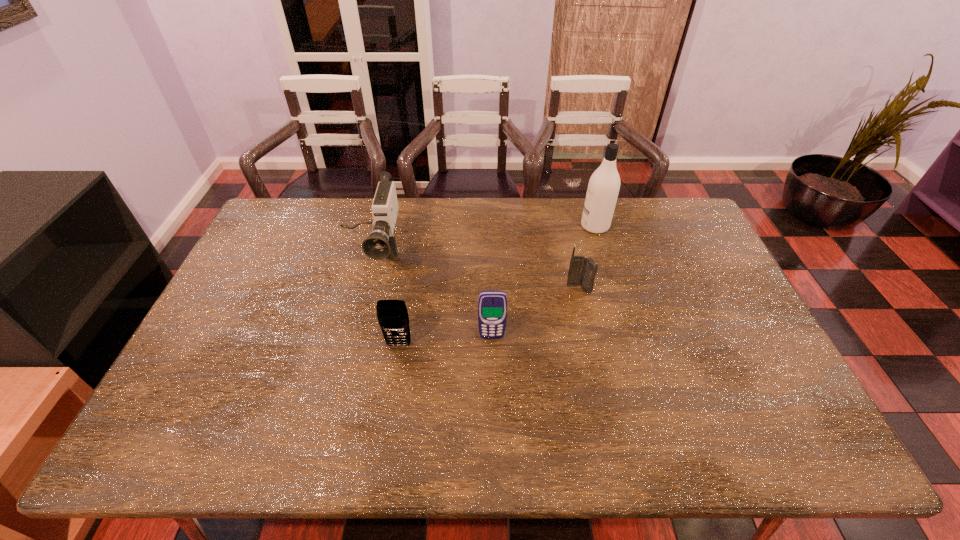
Where is `the rightmost object`? the rightmost object is located at coordinates (603, 188).

I want to click on shampoo, so (603, 188).

Identify the location of camcorder. The height and width of the screenshot is (540, 960). (381, 243).

The width and height of the screenshot is (960, 540). In order to click on the third object from left to right in this screenshot , I will do `click(492, 305)`.

Identify the location of the second farthest cellular telephone. The height and width of the screenshot is (540, 960). (492, 305).

The height and width of the screenshot is (540, 960). In order to click on the nearest cellular telephone in this screenshot , I will do `click(393, 318)`.

This screenshot has width=960, height=540. Find the location of `the nearest object`. the nearest object is located at coordinates (393, 318).

Locate an element on the screen. The height and width of the screenshot is (540, 960). the farthest cellular telephone is located at coordinates (582, 271).

Identify the location of the rightmost cellular telephone. The width and height of the screenshot is (960, 540). (582, 271).

Identify the location of vacant space located on the front-facing side of the shampoo. The image size is (960, 540). (504, 226).